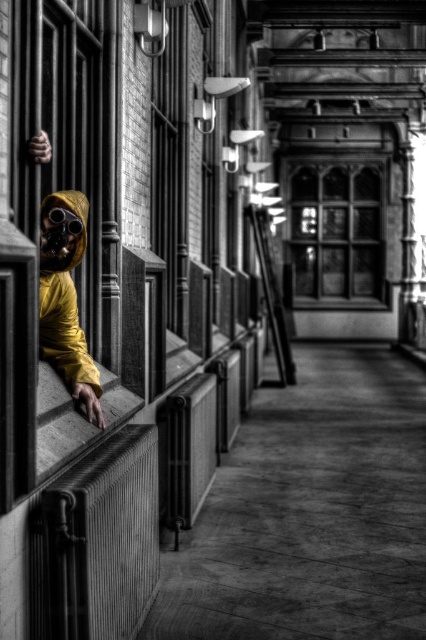
Who is positioned more to the right, stained glass window at center or shiny black goggles at left?

stained glass window at center is more to the right.

Does point (325, 294) lie behind point (69, 216)?

Yes.

I want to click on stained glass window at center, so pyautogui.click(x=336, y=234).